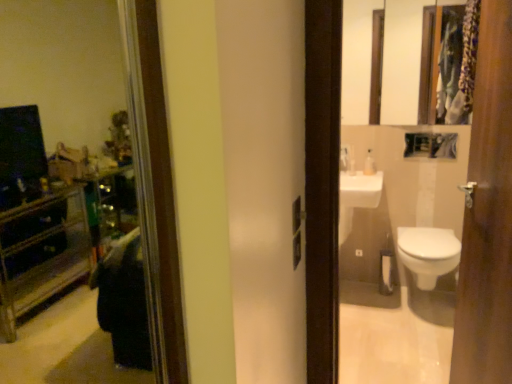
Question: Considering the positions of white glossy soap dispenser at upper center and white glossy toilet at lower right in the image, is white glossy soap dispenser at upper center wider or thinner than white glossy toilet at lower right?

Choices:
 (A) thin
 (B) wide

Answer: (A)

Question: Is white glossy soap dispenser at upper center to the left or to the right of white glossy toilet at lower right in the image?

Choices:
 (A) left
 (B) right

Answer: (A)

Question: Estimate the real-world distances between objects in this image. Which object is closer to the wooden framed mirror at upper right?

Choices:
 (A) wooden door at right
 (B) white glossy soap dispenser at upper center
 (C) white glossy toilet at lower right

Answer: (B)

Question: Based on their relative distances, which object is nearer to the white glossy soap dispenser at upper center?

Choices:
 (A) wooden door at right
 (B) white glossy toilet at lower right
 (C) wooden framed mirror at upper right

Answer: (B)